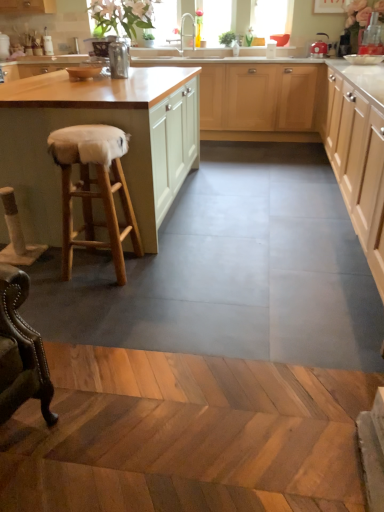
Question: Relative to matte white cabinets at center, which is the 2th cabinetry in right-to-left order, is matte red kettle at upper right in front or behind?

Choices:
 (A) front
 (B) behind

Answer: (B)

Question: Is matte red kettle at upper right to the left or to the right of matte white cabinets at center, which is the second cabinetry in left-to-right order, in the image?

Choices:
 (A) left
 (B) right

Answer: (B)

Question: Estimate the real-world distances between objects in this image. Which object is farther from the wooden stool at left, the 3th cabinetry from the right?

Choices:
 (A) wooden stool at left
 (B) transparent glass window at upper center
 (C) matte red kettle at upper right
 (D) transparent glass window screen at upper center
 (E) matte white cabinets at center, which is the second cabinetry in left-to-right order

Answer: (B)

Question: Which object is positioned farthest from the matte white cabinets at center, which is the second cabinetry in left-to-right order?

Choices:
 (A) wooden stool at left
 (B) matte red kettle at upper right
 (C) matte wood cabinets at right, marked as the third cabinetry in a left-to-right arrangement
 (D) transparent glass window at upper center
 (E) transparent glass window screen at upper center

Answer: (D)